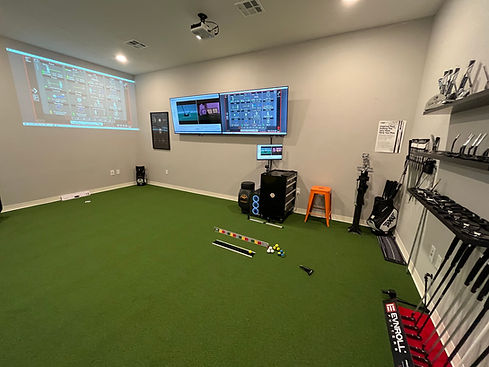
Where is `projector screen`? The width and height of the screenshot is (489, 367). projector screen is located at coordinates (109, 105).